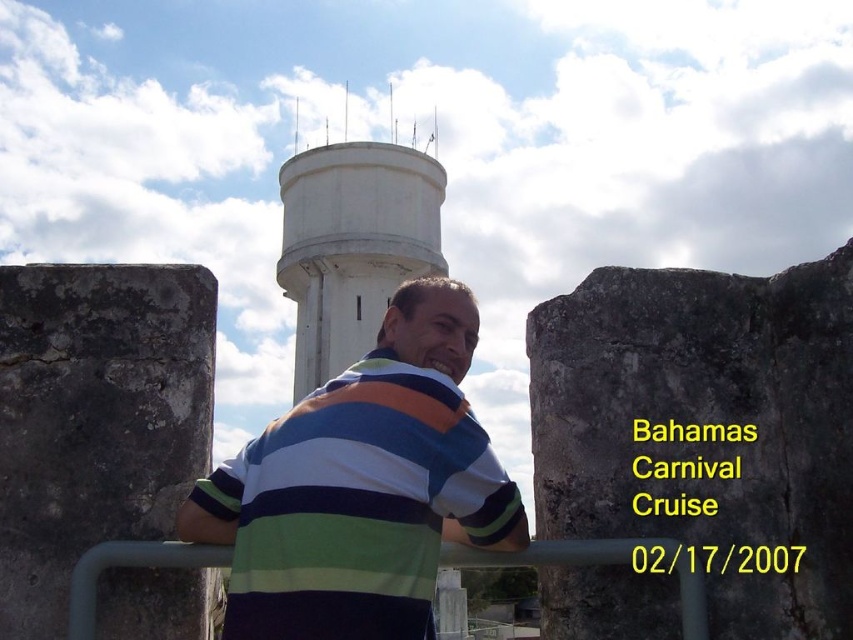
Where is `gray rough stone at center`? This screenshot has width=853, height=640. gray rough stone at center is located at coordinates (706, 429).

What are the coordinates of `gray rough stone at center` in the screenshot? It's located at (706, 429).

Between striped cotton shirt at center and green matte rail at center, which one has more height?

Standing taller between the two is striped cotton shirt at center.

Does striped cotton shirt at center appear on the right side of green matte rail at center?

No, striped cotton shirt at center is not to the right of green matte rail at center.

The width and height of the screenshot is (853, 640). What are the coordinates of `striped cotton shirt at center` in the screenshot? It's located at (363, 486).

Does gray rough stone pillar at left appear under green matte rail at center?

No, gray rough stone pillar at left is not below green matte rail at center.

Is gray rough stone pillar at left above green matte rail at center?

Correct, gray rough stone pillar at left is located above green matte rail at center.

Is point (74, 444) farther from viewer compared to point (166, 561)?

Yes, point (74, 444) is behind point (166, 561).

Where is `gray rough stone pillar at left`? The width and height of the screenshot is (853, 640). gray rough stone pillar at left is located at coordinates (96, 419).